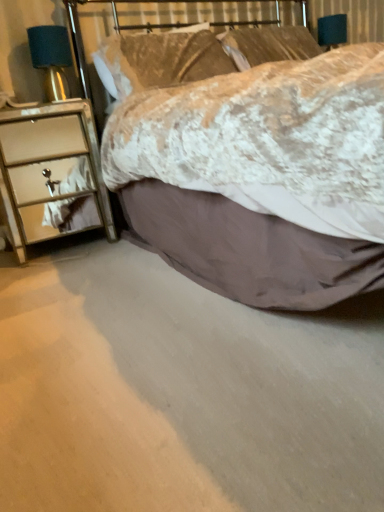
The width and height of the screenshot is (384, 512). Describe the element at coordinates (51, 58) in the screenshot. I see `satin teal lampshade at left` at that location.

Describe the element at coordinates (258, 175) in the screenshot. I see `velvet-like beige bed at center` at that location.

Locate an element on the screen. metallic mirrored chest of drawers at left is located at coordinates (47, 167).

This screenshot has width=384, height=512. In order to click on linen pillow at upper center, which appears as the first pillow when viewed from the right in this screenshot , I will do `click(268, 45)`.

Does linen pillow at upper center, the 2th pillow in the right-to-left sequence, come behind satin teal lampshade at left?

No, linen pillow at upper center, the 2th pillow in the right-to-left sequence, is closer to the camera.

Considering the positions of objects linen pillow at upper center, the first pillow from the left, and satin teal lampshade at left in the image provided, who is more to the right, linen pillow at upper center, the first pillow from the left, or satin teal lampshade at left?

linen pillow at upper center, the first pillow from the left.

Is linen pillow at upper center, the 2th pillow in the right-to-left sequence, facing away from satin teal lampshade at left?

linen pillow at upper center, the 2th pillow in the right-to-left sequence, does not have its back to satin teal lampshade at left.

Is linen pillow at upper center, the first pillow from the left, positioned far away from satin teal lampshade at left?

linen pillow at upper center, the first pillow from the left, is actually quite close to satin teal lampshade at left.

Is metallic mirrored chest of drawers at left with linen pillow at upper center, which appears as the first pillow when viewed from the right?

No, metallic mirrored chest of drawers at left is not beside linen pillow at upper center, which appears as the first pillow when viewed from the right.

Considering the positions of objects metallic mirrored chest of drawers at left and linen pillow at upper center, which appears as the first pillow when viewed from the right, in the image provided, who is behind, metallic mirrored chest of drawers at left or linen pillow at upper center, which appears as the first pillow when viewed from the right,?

linen pillow at upper center, which appears as the first pillow when viewed from the right.

Is metallic mirrored chest of drawers at left to the right of linen pillow at upper center, the second pillow positioned from the left, from the viewer's perspective?

In fact, metallic mirrored chest of drawers at left is to the left of linen pillow at upper center, the second pillow positioned from the left.

From a real-world perspective, is linen pillow at upper center, the second pillow positioned from the left, on linen pillow at upper center, the first pillow from the left?

Yes, from a real-world perspective, linen pillow at upper center, the second pillow positioned from the left, is on top of linen pillow at upper center, the first pillow from the left.

Is linen pillow at upper center, which appears as the first pillow when viewed from the right, beside linen pillow at upper center, the first pillow from the left?

No, linen pillow at upper center, which appears as the first pillow when viewed from the right, is not touching linen pillow at upper center, the first pillow from the left.

Between linen pillow at upper center, the second pillow positioned from the left, and linen pillow at upper center, the 2th pillow in the right-to-left sequence, which one has larger size?

Bigger between the two is linen pillow at upper center, the 2th pillow in the right-to-left sequence.

Which is nearer, [277,56] or [112,88]?

Point [277,56] is closer to the camera than point [112,88].

Is linen pillow at upper center, the first pillow from the left, inside metallic mirrored chest of drawers at left?

No, linen pillow at upper center, the first pillow from the left, is not a part of metallic mirrored chest of drawers at left.

From the image's perspective, is metallic mirrored chest of drawers at left located beneath linen pillow at upper center, the 2th pillow in the right-to-left sequence?

Indeed, from the image's perspective, metallic mirrored chest of drawers at left is shown beneath linen pillow at upper center, the 2th pillow in the right-to-left sequence.

Is metallic mirrored chest of drawers at left aimed at linen pillow at upper center, the first pillow from the left?

No, metallic mirrored chest of drawers at left is not turned towards linen pillow at upper center, the first pillow from the left.

Can you confirm if metallic mirrored chest of drawers at left is thinner than linen pillow at upper center, the 2th pillow in the right-to-left sequence?

In fact, metallic mirrored chest of drawers at left might be wider than linen pillow at upper center, the 2th pillow in the right-to-left sequence.

In the image, there is a linen pillow at upper center, the second pillow positioned from the left. At what (x,y) coordinates should I click in order to perform the action: click on the chest of drawers below it (from the image's perspective). Please return your answer as a coordinate pair (x, y). Looking at the image, I should click on (47, 167).

Is linen pillow at upper center, the second pillow positioned from the left, not close to metallic mirrored chest of drawers at left?

Yes, linen pillow at upper center, the second pillow positioned from the left, is far from metallic mirrored chest of drawers at left.

Considering the relative sizes of linen pillow at upper center, the second pillow positioned from the left, and metallic mirrored chest of drawers at left in the image provided, is linen pillow at upper center, the second pillow positioned from the left, wider than metallic mirrored chest of drawers at left?

Incorrect, the width of linen pillow at upper center, the second pillow positioned from the left, does not surpass that of metallic mirrored chest of drawers at left.

Does satin teal lampshade at left turn towards linen pillow at upper center, the first pillow from the left?

No.

From the image's perspective, which object appears higher, satin teal lampshade at left or linen pillow at upper center, the first pillow from the left?

linen pillow at upper center, the first pillow from the left, appears higher in the image.

Does satin teal lampshade at left have a smaller size compared to linen pillow at upper center, the first pillow from the left?

Indeed, satin teal lampshade at left has a smaller size compared to linen pillow at upper center, the first pillow from the left.

Consider the image. Between satin teal lampshade at left and linen pillow at upper center, the first pillow from the left, which one has smaller width?

satin teal lampshade at left.

From the image's perspective, is satin teal lampshade at left located beneath velvet-like beige bed at center?

No, from the image's perspective, satin teal lampshade at left is not below velvet-like beige bed at center.

Considering the relative sizes of satin teal lampshade at left and velvet-like beige bed at center in the image provided, is satin teal lampshade at left wider than velvet-like beige bed at center?

Incorrect, the width of satin teal lampshade at left does not surpass that of velvet-like beige bed at center.

Between satin teal lampshade at left and velvet-like beige bed at center, which one has larger size?

Bigger between the two is velvet-like beige bed at center.

In the scene shown: Would you say satin teal lampshade at left contains velvet-like beige bed at center?

No, satin teal lampshade at left does not contain velvet-like beige bed at center.

Starting from the satin teal lampshade at left, which pillow is the 1st one to the right? Please provide its 2D coordinates.

[(159, 60)]

The image size is (384, 512). What are the coordinates of `pillow that is the 2nd object located behind the metallic mirrored chest of drawers at left` in the screenshot? It's located at (268, 45).

Based on their spatial positions, is linen pillow at upper center, the first pillow from the left, or satin teal lampshade at left closer to velvet-like beige bed at center?

linen pillow at upper center, the first pillow from the left, is positioned closer to the anchor velvet-like beige bed at center.

In the scene shown: When comparing their distances from linen pillow at upper center, the 2th pillow in the right-to-left sequence, does metallic mirrored chest of drawers at left or satin teal lampshade at left seem further?

The object further to linen pillow at upper center, the 2th pillow in the right-to-left sequence, is metallic mirrored chest of drawers at left.

From the image, which object appears to be farther from metallic mirrored chest of drawers at left, linen pillow at upper center, the 2th pillow in the right-to-left sequence, or satin teal lampshade at left?

Based on the image, linen pillow at upper center, the 2th pillow in the right-to-left sequence, appears to be further to metallic mirrored chest of drawers at left.

Based on their spatial positions, is metallic mirrored chest of drawers at left or linen pillow at upper center, the second pillow positioned from the left, further from satin teal lampshade at left?

linen pillow at upper center, the second pillow positioned from the left, lies further to satin teal lampshade at left than the other object.

From the image, which object appears to be nearer to linen pillow at upper center, the second pillow positioned from the left, metallic mirrored chest of drawers at left or velvet-like beige bed at center?

metallic mirrored chest of drawers at left is positioned closer to the anchor linen pillow at upper center, the second pillow positioned from the left.

From the image, which object appears to be nearer to linen pillow at upper center, which appears as the first pillow when viewed from the right, satin teal lampshade at left or metallic mirrored chest of drawers at left?

satin teal lampshade at left lies closer to linen pillow at upper center, which appears as the first pillow when viewed from the right, than the other object.

Looking at the image, which one is located closer to linen pillow at upper center, the 2th pillow in the right-to-left sequence, velvet-like beige bed at center or metallic mirrored chest of drawers at left?

metallic mirrored chest of drawers at left.

Based on their spatial positions, is linen pillow at upper center, the second pillow positioned from the left, or metallic mirrored chest of drawers at left closer to satin teal lampshade at left?

metallic mirrored chest of drawers at left lies closer to satin teal lampshade at left than the other object.

The image size is (384, 512). Find the location of `bedside lamp between linen pillow at upper center, the first pillow from the left, and metallic mirrored chest of drawers at left from top to bottom`. bedside lamp between linen pillow at upper center, the first pillow from the left, and metallic mirrored chest of drawers at left from top to bottom is located at coordinates (51, 58).

Image resolution: width=384 pixels, height=512 pixels. I want to click on pillow between velvet-like beige bed at center and satin teal lampshade at left in the front-back direction, so click(159, 60).

You are a GUI agent. You are given a task and a screenshot of the screen. Output one action in this format:
    pyautogui.click(x=<x>, y=<y>)
    Task: Click on the chest of drawers between velvet-like beige bed at center and linen pillow at upper center, the first pillow from the left, in the front-back direction
    
    Given the screenshot: What is the action you would take?
    pyautogui.click(x=47, y=167)

At what (x,y) coordinates should I click in order to perform the action: click on bedside lamp between velvet-like beige bed at center and linen pillow at upper center, the second pillow positioned from the left, from front to back. Please return your answer as a coordinate pair (x, y). Looking at the image, I should click on (51, 58).